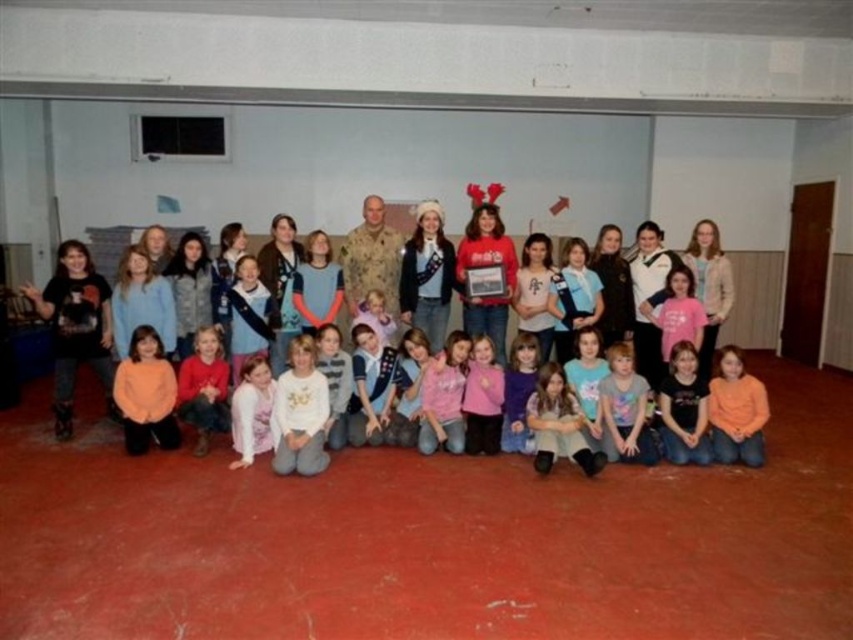
In the scene shown: You are a photographer trying to adjust the lighting for a group photo. You notice the matte black jacket at center and the orange fleece sweater at lower left. Which clothing item is positioned higher in the image?

The matte black jacket at center is taller than the orange fleece sweater at lower left, so it is positioned higher in the image.

You are standing in the community center and want to find the matte black jacket at center. According to the coordinates provided, where should you look relative to the window?

The matte black jacket at center is located at point 0.464 on the horizontal axis and 0.884 on the vertical axis. Since the window is in the background, the vertical coordinate 0.884 indicates it is closer to the bottom of the image, meaning the jacket is positioned near the lower part of the scene, closer to the window.